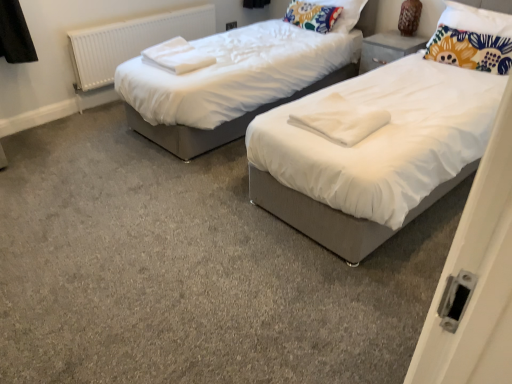
Question: From the image's perspective, does white soft towel at center, which is counted as the 1th linen, starting from the bottom, appear higher than floral fabric pillow at upper right, the second pillow from the left?

Choices:
 (A) yes
 (B) no

Answer: (B)

Question: Considering the relative positions of white soft towel at center, marked as the 1th linen in a right-to-left arrangement, and floral fabric pillow at upper right, the 2th pillow when ordered from back to front, in the image provided, is white soft towel at center, marked as the 1th linen in a right-to-left arrangement, behind floral fabric pillow at upper right, the 2th pillow when ordered from back to front,?

Choices:
 (A) yes
 (B) no

Answer: (B)

Question: Considering the relative sizes of white soft towel at center, marked as the 1th linen in a right-to-left arrangement, and floral fabric pillow at upper right, the second pillow from the left, in the image provided, is white soft towel at center, marked as the 1th linen in a right-to-left arrangement, shorter than floral fabric pillow at upper right, the second pillow from the left,?

Choices:
 (A) no
 (B) yes

Answer: (B)

Question: Can you confirm if white soft towel at center, which ranks as the second linen in back-to-front order, is positioned to the left of floral fabric pillow at upper right, the second pillow from the left?

Choices:
 (A) no
 (B) yes

Answer: (B)

Question: Is white soft towel at center, marked as the 1th linen in a right-to-left arrangement, touching floral fabric pillow at upper right, the second pillow from the left?

Choices:
 (A) no
 (B) yes

Answer: (A)

Question: Is floral fabric pillow at upper center, placed as the 2th pillow when sorted from right to left, bigger or smaller than matte gray nightstand at upper right?

Choices:
 (A) small
 (B) big

Answer: (B)

Question: Based on their positions, is floral fabric pillow at upper center, which ranks as the second pillow in front-to-back order, located to the left or right of matte gray nightstand at upper right?

Choices:
 (A) left
 (B) right

Answer: (A)

Question: Is floral fabric pillow at upper center, placed as the 2th pillow when sorted from right to left, wider or thinner than matte gray nightstand at upper right?

Choices:
 (A) thin
 (B) wide

Answer: (A)

Question: Is point (349, 23) closer or farther from the camera than point (396, 44)?

Choices:
 (A) farther
 (B) closer

Answer: (A)

Question: Is floral fabric pillow at upper right, positioned as the first pillow in front-to-back order, taller or shorter than white soft towels at upper left, the 2th linen viewed from the right?

Choices:
 (A) tall
 (B) short

Answer: (A)

Question: From the image's perspective, is floral fabric pillow at upper right, placed as the 1th pillow when sorted from right to left, located above or below white soft towels at upper left, the 2th linen in the bottom-to-top sequence?

Choices:
 (A) above
 (B) below

Answer: (A)

Question: Based on their sizes in the image, would you say floral fabric pillow at upper right, positioned as the first pillow in front-to-back order, is bigger or smaller than white soft towels at upper left, the 2th linen viewed from the right?

Choices:
 (A) big
 (B) small

Answer: (A)

Question: Which is correct: floral fabric pillow at upper right, the 2th pillow when ordered from back to front, is inside white soft towels at upper left, acting as the 1th linen starting from the top, or outside of it?

Choices:
 (A) outside
 (B) inside

Answer: (A)

Question: Is point (467, 51) positioned closer to the camera than point (188, 33)?

Choices:
 (A) closer
 (B) farther

Answer: (A)

Question: From a real-world perspective, is floral fabric pillow at upper right, the 2th pillow when ordered from back to front, positioned above or below white plastic radiator at left?

Choices:
 (A) below
 (B) above

Answer: (B)